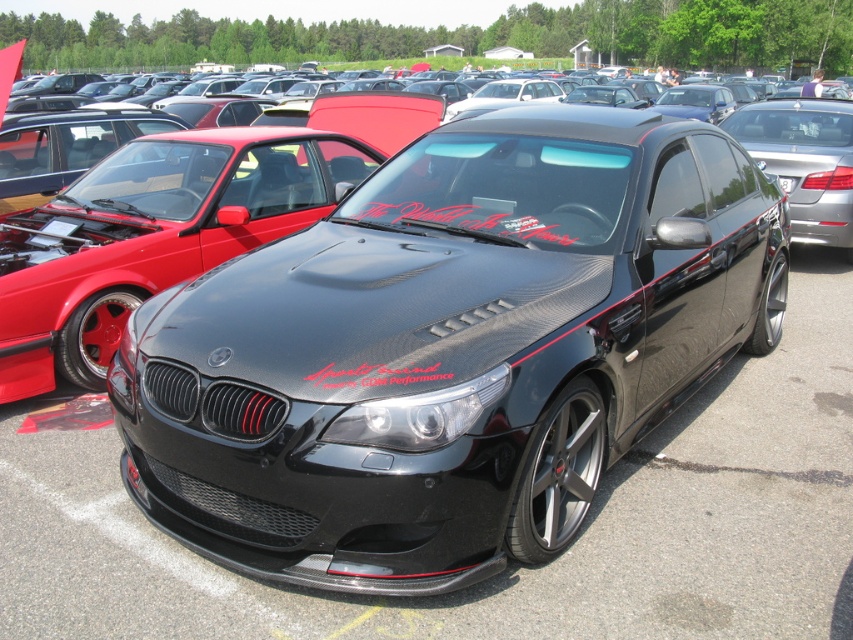
Is black carbon fiber sedan at center behind black carbon fiber license plate at center?

Yes, black carbon fiber sedan at center is further from the viewer.

Which is behind, point (817, 237) or point (782, 188)?

Point (817, 237)

Is point (846, 241) in front of point (790, 188)?

That is False.

Where is `black carbon fiber sedan at center`? The width and height of the screenshot is (853, 640). black carbon fiber sedan at center is located at coordinates (805, 161).